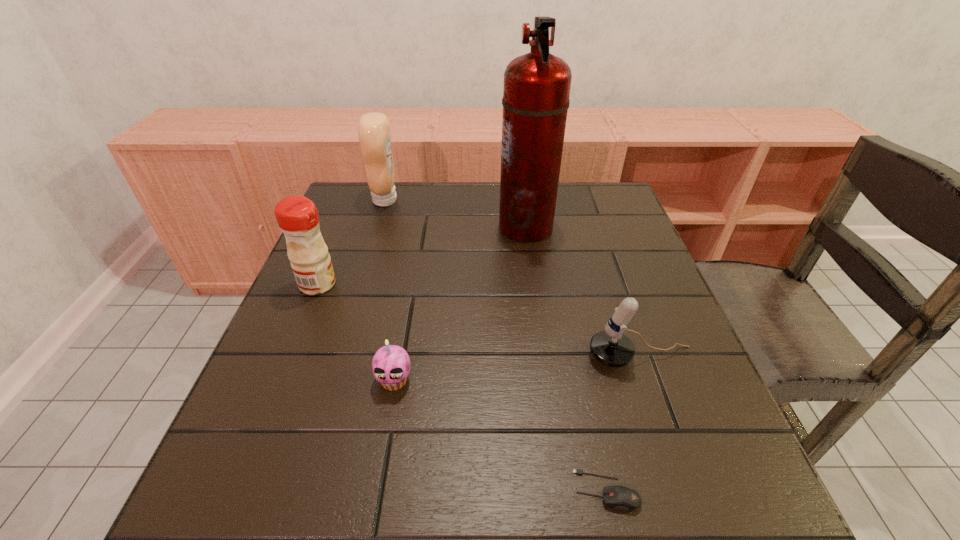
The image size is (960, 540). Find the location of `unoccupied area between the second object from left to right and the nearer condiment`. unoccupied area between the second object from left to right and the nearer condiment is located at coordinates (351, 242).

The image size is (960, 540). What are the coordinates of `free spot between the tallest object and the left condiment` in the screenshot? It's located at (421, 255).

At what (x,y) coordinates should I click in order to perform the action: click on vacant space that's between the microphone and the farther condiment. Please return your answer as a coordinate pair (x, y). Looking at the image, I should click on [514, 279].

In order to click on unoccupied position between the fourth object from right to left and the tallest object in this screenshot , I will do `click(460, 303)`.

Identify the location of free spot between the left condiment and the mouse. The image size is (960, 540). (462, 387).

Identify the location of unoccupied position between the farther condiment and the nearest object. The height and width of the screenshot is (540, 960). (496, 345).

The image size is (960, 540). Find the location of `free space between the microphone and the shortest object`. free space between the microphone and the shortest object is located at coordinates (624, 423).

The image size is (960, 540). Find the location of `empty space that is in between the nearer condiment and the mouse`. empty space that is in between the nearer condiment and the mouse is located at coordinates (462, 387).

The image size is (960, 540). Identify the location of free space between the right condiment and the cupcake. (390, 290).

Find the location of a particular element. This screenshot has width=960, height=540. empty space between the right condiment and the mouse is located at coordinates (496, 345).